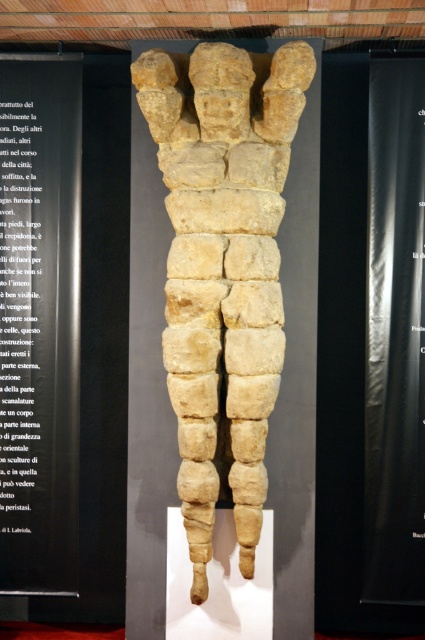
You are an art student who wants to sketch the sculpture. You notice two black papers in the scene. Which one is closer to you, the black paper at left or the black paper at upper left?

The black paper at left is closer to the viewer than the black paper at upper left.

You are an art student who needs to place a small label on the black paper at left and another label on the black paper at upper left. Which label should you make smaller to ensure it fits properly?

The label for the black paper at upper left should be smaller because the black paper at upper left is smaller than the black paper at left.